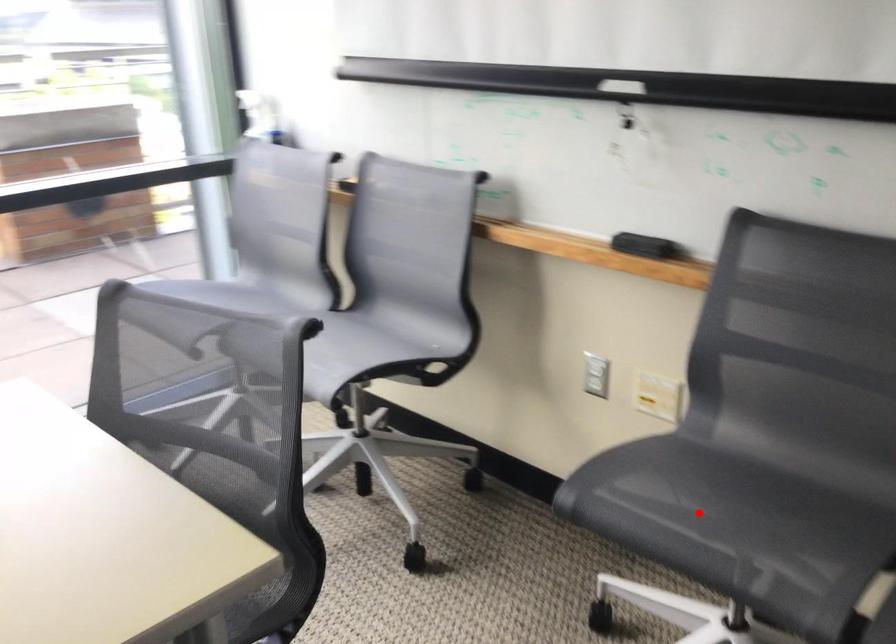
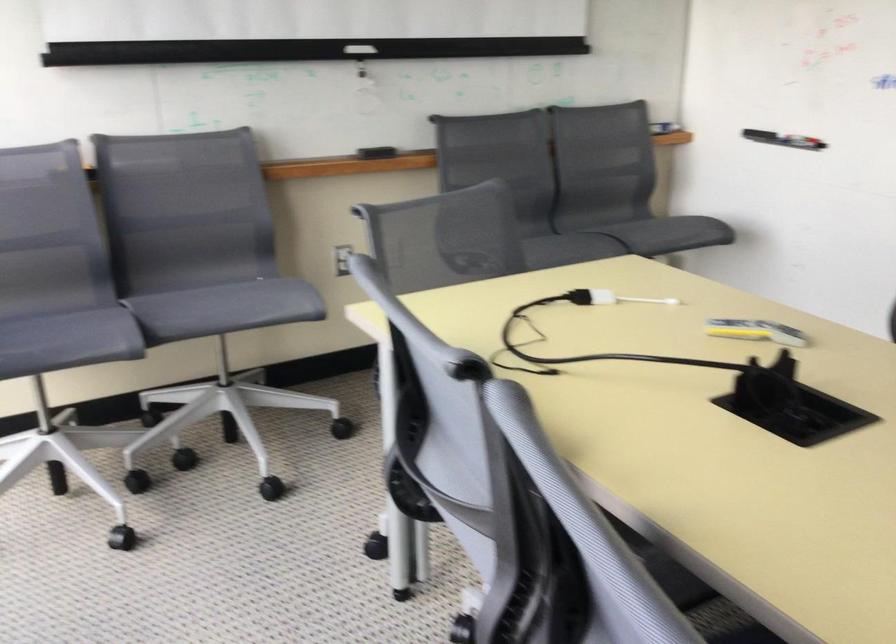
Question: A red point is marked in image1. In image2, is the corresponding 3D point closer to the camera or farther? Reply with the corresponding letter.

Choices:
 (A) The corresponding 3D point is closer.
 (B) The corresponding 3D point is farther.

Answer: (B)